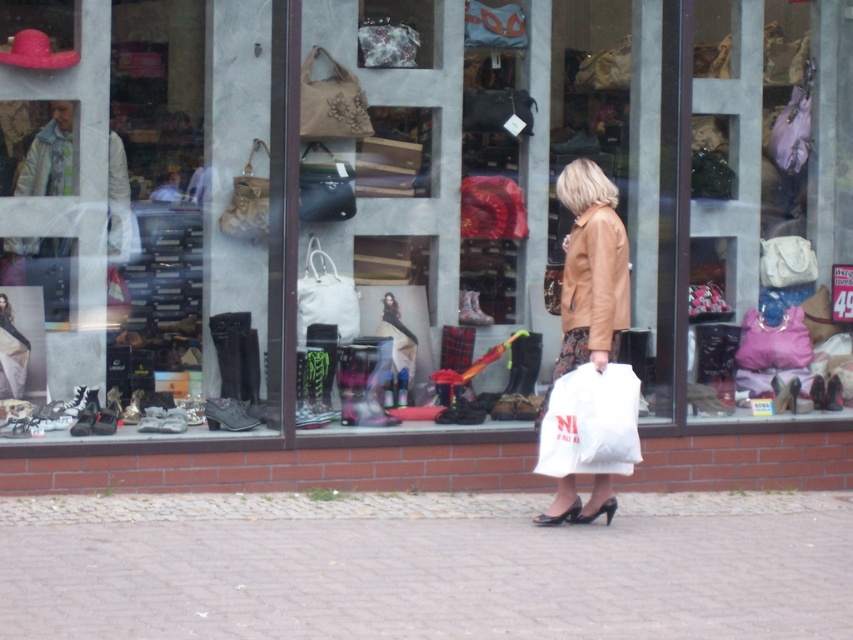
You are standing in front of the store looking at the window display. There are two points marked on the window at coordinates point (601, 264) and point (10, 353). Which point appears closer to you?

Point (601, 264) is closer to the camera than point (10, 353), so the point at (601, 264) appears closer to you.

You are standing in front of the store and want to walk to the point marked as point [19,340]. However, there is an obstacle at point [578,188]. Will you need to go around it?

Yes, you will need to go around the obstacle at point [578,188] because it is in front of your destination point [19,340].